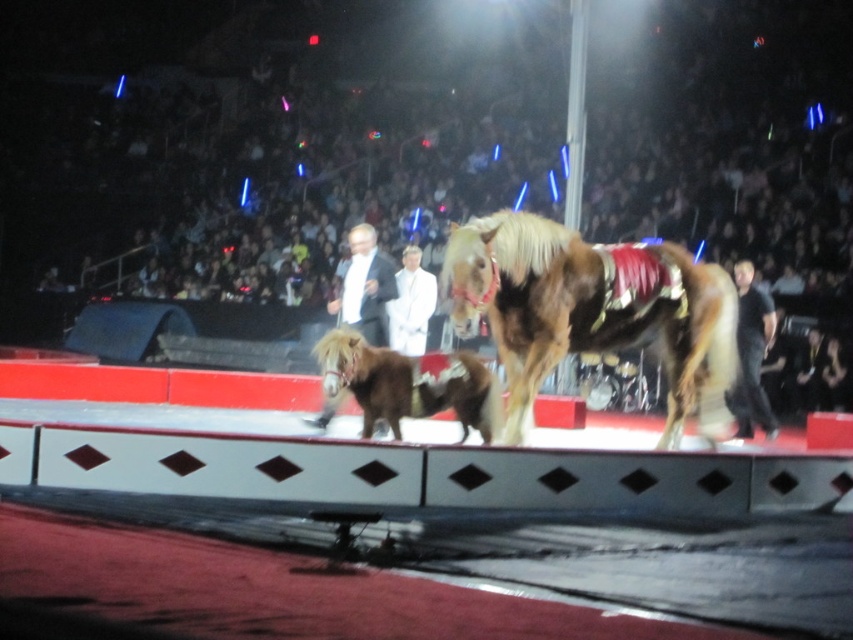
You are standing at the center of the arena and want to reach the point marked at coordinates point (329, 301). If your maximum comfortable walking distance is 50 feet, will you be able to comfortably walk to that point?

The distance of point (329, 301) from camera is 46.53 feet, which is within your maximum comfortable walking distance of 50 feet. Therefore, you can comfortably walk to that point.

You are a stagehand needing to move a 3.5 meter long ladder from the storage area to the stage. The ladder must be placed between the brown fuzzy horse at center and the black smooth shirt at right. Is there enough space for the ladder to fit between them?

The distance between the brown fuzzy horse at center and the black smooth shirt at right is 3.76 meters. Since the ladder is 3.5 meters long, it can fit between them as there is sufficient space.

You are a performer standing at the center of the stage. You see two points marked on the stage floor. The first point is at coordinate point(x=404, y=372) and the second point is at coordinate point(x=753, y=321). Which point is closer to you?

Point(x=404, y=372) is in front of point(x=753, y=321), so it is closer to you.